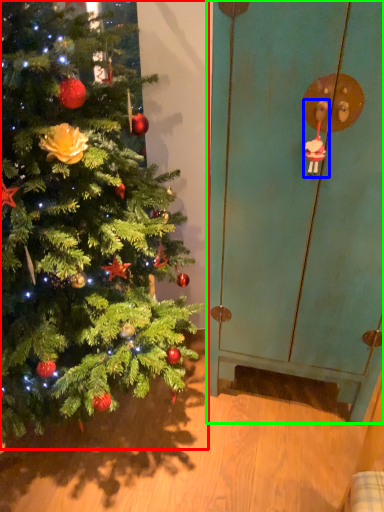
Question: Which is nearer to the christmas tree (highlighted by a red box)? toy (highlighted by a blue box) or screen door (highlighted by a green box).

Choices:
 (A) toy
 (B) screen door

Answer: (B)